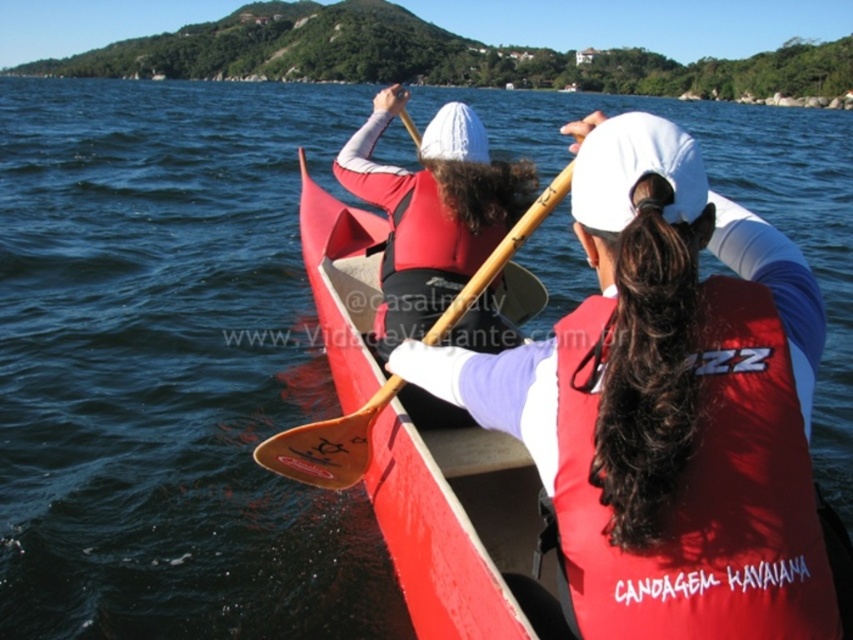
Question: Can you confirm if red matte life jacket at center is positioned below wooden paddle at center?

Choices:
 (A) yes
 (B) no

Answer: (A)

Question: Can you confirm if red matte life jacket at center is wider than wooden paddle at center?

Choices:
 (A) yes
 (B) no

Answer: (B)

Question: Can you confirm if red matte life jacket at center is wider than wooden paddle at center?

Choices:
 (A) no
 (B) yes

Answer: (A)